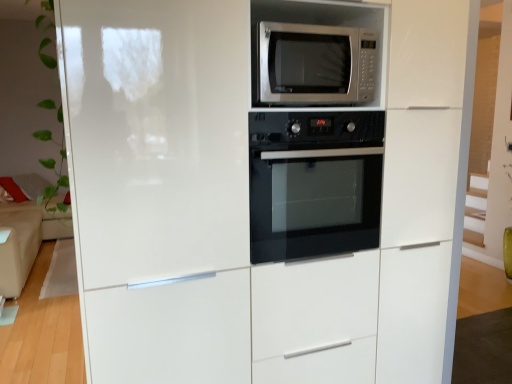
Question: Does beige fabric couch at left have a lesser height compared to satin silver microwave at upper center?

Choices:
 (A) no
 (B) yes

Answer: (A)

Question: Is beige fabric couch at left positioned far away from satin silver microwave at upper center?

Choices:
 (A) yes
 (B) no

Answer: (A)

Question: Does beige fabric couch at left have a smaller size compared to satin silver microwave at upper center?

Choices:
 (A) yes
 (B) no

Answer: (B)

Question: Does beige fabric couch at left have a lesser width compared to satin silver microwave at upper center?

Choices:
 (A) yes
 (B) no

Answer: (B)

Question: Is beige fabric couch at left turned away from satin silver microwave at upper center?

Choices:
 (A) yes
 (B) no

Answer: (B)

Question: From the image's perspective, is black glass oven at center above or below satin silver microwave at upper center?

Choices:
 (A) below
 (B) above

Answer: (A)

Question: Considering the positions of point (326, 180) and point (292, 86), is point (326, 180) closer or farther from the camera than point (292, 86)?

Choices:
 (A) farther
 (B) closer

Answer: (A)

Question: Do you think black glass oven at center is within satin silver microwave at upper center, or outside of it?

Choices:
 (A) inside
 (B) outside

Answer: (B)

Question: Is black glass oven at center taller or shorter than satin silver microwave at upper center?

Choices:
 (A) tall
 (B) short

Answer: (A)

Question: From a real-world perspective, is black glass oven at center above or below beige fabric couch at left?

Choices:
 (A) below
 (B) above

Answer: (B)

Question: Is point (331, 173) closer or farther from the camera than point (6, 183)?

Choices:
 (A) closer
 (B) farther

Answer: (A)

Question: Visually, is black glass oven at center positioned to the left or to the right of beige fabric couch at left?

Choices:
 (A) right
 (B) left

Answer: (A)

Question: Choose the correct answer: Is black glass oven at center inside beige fabric couch at left or outside it?

Choices:
 (A) inside
 (B) outside

Answer: (B)

Question: Is satin silver microwave at upper center taller or shorter than black glass oven at center?

Choices:
 (A) short
 (B) tall

Answer: (A)

Question: Is satin silver microwave at upper center inside the boundaries of black glass oven at center, or outside?

Choices:
 (A) inside
 (B) outside

Answer: (B)